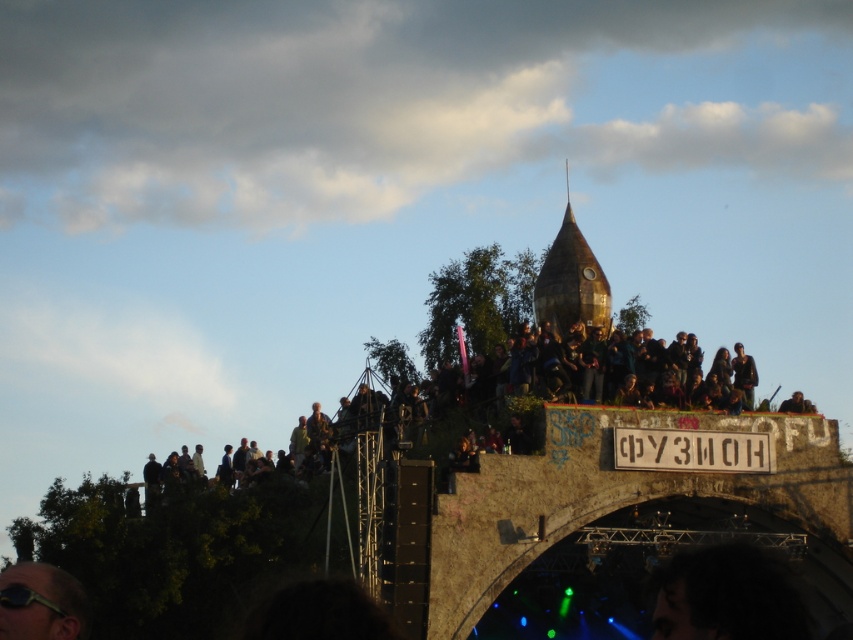
Question: Which point appears closest to the camera in this image?

Choices:
 (A) (490, 576)
 (B) (77, 630)
 (C) (543, 269)

Answer: (B)

Question: Which of these objects is positioned farthest from the matte black sunglasses at lower left?

Choices:
 (A) stone bridge at upper center
 (B) gold metallic dome at center

Answer: (B)

Question: Which object is closer to the camera taking this photo?

Choices:
 (A) gold metallic dome at center
 (B) stone bridge at upper center
 (C) matte black sunglasses at lower left

Answer: (C)

Question: Can you confirm if stone bridge at upper center is positioned to the right of matte black sunglasses at lower left?

Choices:
 (A) yes
 (B) no

Answer: (A)

Question: Can you confirm if stone bridge at upper center is positioned below matte black sunglasses at lower left?

Choices:
 (A) no
 (B) yes

Answer: (A)

Question: Can you confirm if stone bridge at upper center is thinner than gold metallic dome at center?

Choices:
 (A) yes
 (B) no

Answer: (B)